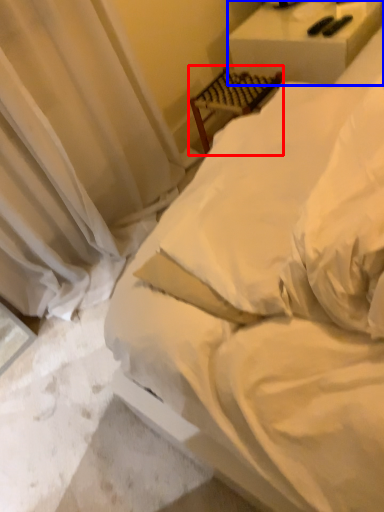
Question: Among these objects, which one is farthest to the camera, furniture (highlighted by a red box) or furniture (highlighted by a blue box)?

Choices:
 (A) furniture
 (B) furniture

Answer: (A)